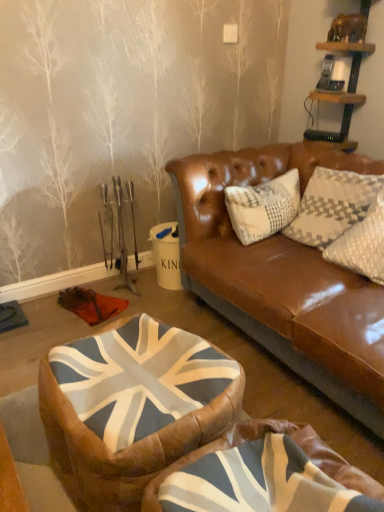
Question: Considering the relative sizes of union jack fabric bean bag at center, which is the first bean bag chair from back to front, and union jack fabric bean bag at center, the first bean bag chair from the front, in the image provided, is union jack fabric bean bag at center, which is the first bean bag chair from back to front, smaller than union jack fabric bean bag at center, the first bean bag chair from the front,?

Choices:
 (A) yes
 (B) no

Answer: (B)

Question: Would you say union jack fabric bean bag at center, which is the first bean bag chair from back to front, is outside union jack fabric bean bag at center, the first bean bag chair from the front?

Choices:
 (A) no
 (B) yes

Answer: (B)

Question: From a real-world perspective, is union jack fabric bean bag at center, which is the first bean bag chair from back to front, positioned over union jack fabric bean bag at center, the first bean bag chair from the front, based on gravity?

Choices:
 (A) yes
 (B) no

Answer: (B)

Question: Is union jack fabric bean bag at center, arranged as the 2th bean bag chair when viewed from the front, far from union jack fabric bean bag at center, positioned as the 2th bean bag chair in back-to-front order?

Choices:
 (A) no
 (B) yes

Answer: (A)

Question: Is union jack fabric bean bag at center, which is the first bean bag chair from back to front, thinner than union jack fabric bean bag at center, the first bean bag chair from the front?

Choices:
 (A) no
 (B) yes

Answer: (B)

Question: Considering the positions of union jack fabric bean bag at center, positioned as the 2th bean bag chair in back-to-front order, and union jack fabric bean bag at center, which is the first bean bag chair from back to front, in the image, is union jack fabric bean bag at center, positioned as the 2th bean bag chair in back-to-front order, wider or thinner than union jack fabric bean bag at center, which is the first bean bag chair from back to front,?

Choices:
 (A) wide
 (B) thin

Answer: (A)

Question: Does point (259, 467) appear closer or farther from the camera than point (150, 398)?

Choices:
 (A) closer
 (B) farther

Answer: (A)

Question: Considering their positions, is union jack fabric bean bag at center, positioned as the 2th bean bag chair in back-to-front order, located in front of or behind union jack fabric bean bag at center, arranged as the 2th bean bag chair when viewed from the front?

Choices:
 (A) front
 (B) behind

Answer: (A)

Question: Would you say union jack fabric bean bag at center, positioned as the 2th bean bag chair in back-to-front order, is to the left or to the right of union jack fabric bean bag at center, arranged as the 2th bean bag chair when viewed from the front, in the picture?

Choices:
 (A) left
 (B) right

Answer: (B)

Question: Considering the positions of union jack fabric bean bag at center, positioned as the 2th bean bag chair in back-to-front order, and wooden shelf at upper right in the image, is union jack fabric bean bag at center, positioned as the 2th bean bag chair in back-to-front order, wider or thinner than wooden shelf at upper right?

Choices:
 (A) wide
 (B) thin

Answer: (A)

Question: Is union jack fabric bean bag at center, positioned as the 2th bean bag chair in back-to-front order, bigger or smaller than wooden shelf at upper right?

Choices:
 (A) small
 (B) big

Answer: (B)

Question: From the image's perspective, is union jack fabric bean bag at center, the first bean bag chair from the front, positioned above or below wooden shelf at upper right?

Choices:
 (A) above
 (B) below

Answer: (B)

Question: In the image, is union jack fabric bean bag at center, positioned as the 2th bean bag chair in back-to-front order, positioned in front of or behind wooden shelf at upper right?

Choices:
 (A) front
 (B) behind

Answer: (A)

Question: Is union jack fabric bean bag at center, which is the first bean bag chair from back to front, inside the boundaries of union jack fabric bean bag at center, positioned as the 2th bean bag chair in back-to-front order, or outside?

Choices:
 (A) outside
 (B) inside

Answer: (A)

Question: Is union jack fabric bean bag at center, arranged as the 2th bean bag chair when viewed from the front, to the left or to the right of union jack fabric bean bag at center, positioned as the 2th bean bag chair in back-to-front order, in the image?

Choices:
 (A) right
 (B) left

Answer: (B)